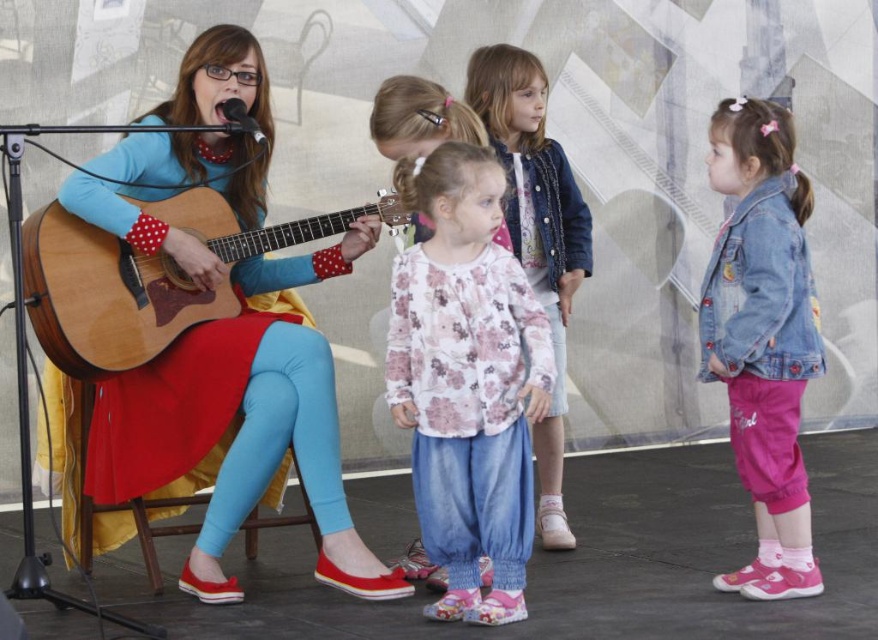
Between floral cotton shirt at center and floral fabric shirt at center, which one is positioned higher?

floral fabric shirt at center

Between point (443, 499) and point (565, 269), which one is positioned in front?

Point (443, 499)

The image size is (878, 640). Describe the element at coordinates (466, 381) in the screenshot. I see `floral cotton shirt at center` at that location.

This screenshot has height=640, width=878. I want to click on floral cotton shirt at center, so click(466, 381).

Between floral cotton shirt at center and denim jacket at lower right, which one has less height?

floral cotton shirt at center

Is floral cotton shirt at center positioned before denim jacket at lower right?

That is True.

Is point (519, 397) more distant than point (740, 460)?

No, it is in front of (740, 460).

The image size is (878, 640). Find the location of `floral cotton shirt at center`. floral cotton shirt at center is located at coordinates (466, 381).

Between point (700, 310) and point (205, 230), which one is positioned behind?

The point (205, 230) is behind.

Is point (778, 141) farther from camera compared to point (95, 243)?

No.

Where is `denim jacket at lower right`? The image size is (878, 640). denim jacket at lower right is located at coordinates (761, 337).